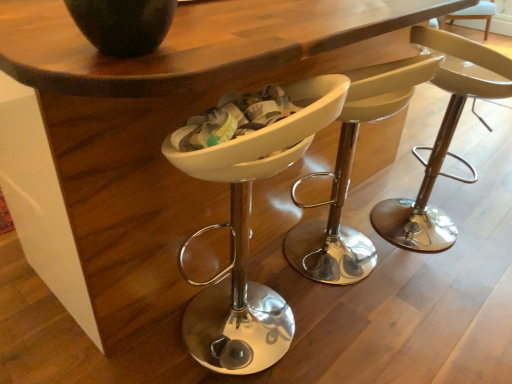
Identify the location of vacant space to the right of white plastic chair at center, which ranks as the 3th chair in right-to-left order. (361, 333).